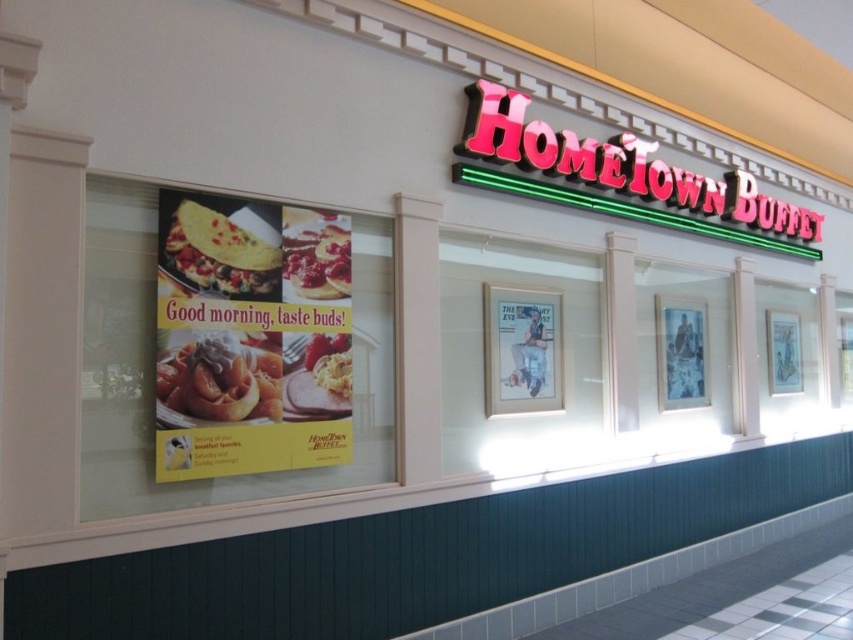
Which is in front, point (257, 248) or point (297, 252)?

Point (257, 248) is more forward.

Is point (194, 244) positioned after point (300, 294)?

No.

Identify the location of matte yellow omelette at upper left. (219, 252).

Between golden waffle at center and matte yellow omelette at upper left, which one appears on the left side from the viewer's perspective?

From the viewer's perspective, matte yellow omelette at upper left appears more on the left side.

The image size is (853, 640). What are the coordinates of `golden waffle at center` in the screenshot? It's located at (219, 380).

Find the location of a particular element. This screenshot has height=640, width=853. golden waffle at center is located at coordinates (219, 380).

Find the location of a particular element. The height and width of the screenshot is (640, 853). golden waffle at center is located at coordinates (219, 380).

Looking at this image, is golden waffle at center further to camera compared to smooth white pancake at center?

That is False.

Does golden waffle at center appear under smooth white pancake at center?

Correct, golden waffle at center is located below smooth white pancake at center.

Is point (264, 397) in front of point (306, 285)?

That is True.

Image resolution: width=853 pixels, height=640 pixels. Identify the location of golden waffle at center. (219, 380).